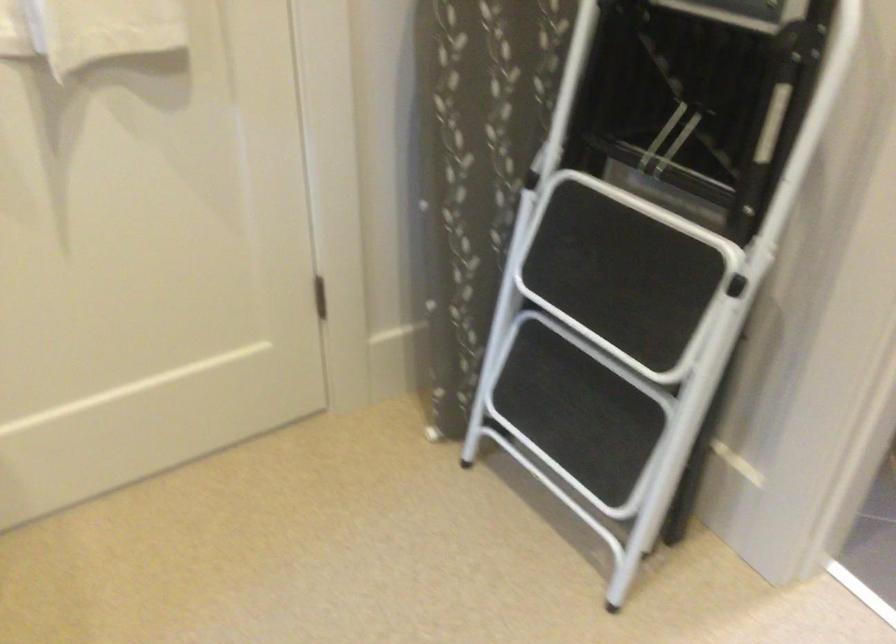
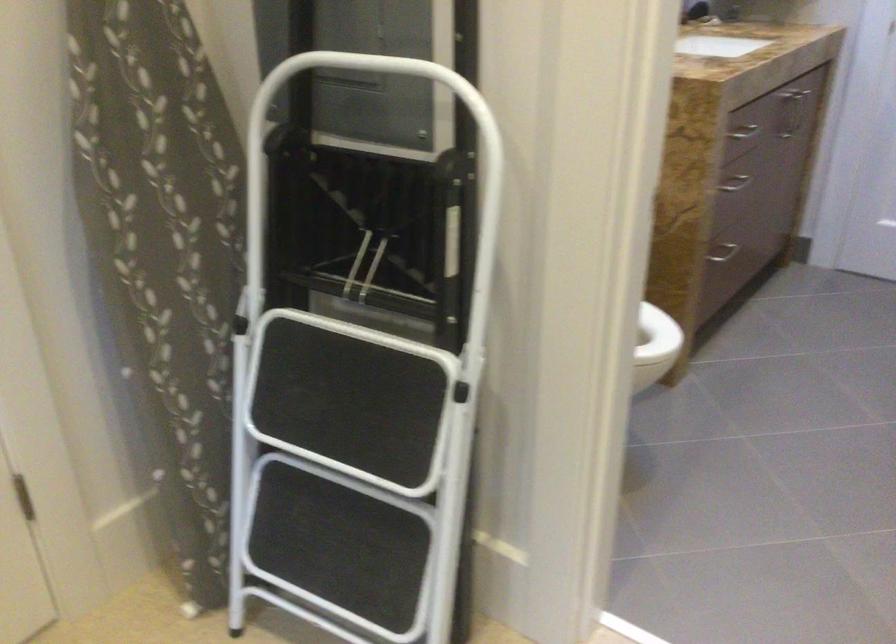
In a continuous first-person perspective shot, in which direction is the camera moving?

The cameraman moved toward right, forward.